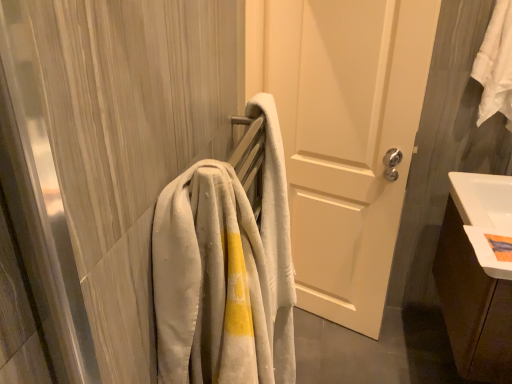
Question: Can you confirm if light gray plush towel at left is bigger than brown wood cabinet at lower right?

Choices:
 (A) yes
 (B) no

Answer: (B)

Question: Is light gray plush towel at left far away from brown wood cabinet at lower right?

Choices:
 (A) yes
 (B) no

Answer: (B)

Question: Does light gray plush towel at left have a lesser width compared to brown wood cabinet at lower right?

Choices:
 (A) no
 (B) yes

Answer: (B)

Question: Can you confirm if light gray plush towel at left is taller than brown wood cabinet at lower right?

Choices:
 (A) yes
 (B) no

Answer: (A)

Question: Is light gray plush towel at left smaller than brown wood cabinet at lower right?

Choices:
 (A) no
 (B) yes

Answer: (B)

Question: From their relative heights in the image, would you say white cotton towel at upper right is taller or shorter than light gray plush towel at left?

Choices:
 (A) short
 (B) tall

Answer: (A)

Question: In terms of width, does white cotton towel at upper right look wider or thinner when compared to light gray plush towel at left?

Choices:
 (A) thin
 (B) wide

Answer: (A)

Question: Is white cotton towel at upper right bigger or smaller than light gray plush towel at left?

Choices:
 (A) big
 (B) small

Answer: (B)

Question: Is point (485, 82) positioned closer to the camera than point (177, 357)?

Choices:
 (A) farther
 (B) closer

Answer: (A)

Question: Is white glossy sink at lower right to the left or to the right of white cotton towel at upper right in the image?

Choices:
 (A) right
 (B) left

Answer: (B)

Question: Considering their positions, is white glossy sink at lower right located in front of or behind white cotton towel at upper right?

Choices:
 (A) behind
 (B) front

Answer: (B)

Question: Is white glossy sink at lower right bigger or smaller than white cotton towel at upper right?

Choices:
 (A) big
 (B) small

Answer: (A)

Question: Is point (507, 200) closer or farther from the camera than point (479, 117)?

Choices:
 (A) farther
 (B) closer

Answer: (B)

Question: In terms of width, does white cotton towel at upper right look wider or thinner when compared to brown wood cabinet at lower right?

Choices:
 (A) wide
 (B) thin

Answer: (B)

Question: From the image's perspective, is white cotton towel at upper right positioned above or below brown wood cabinet at lower right?

Choices:
 (A) above
 (B) below

Answer: (A)